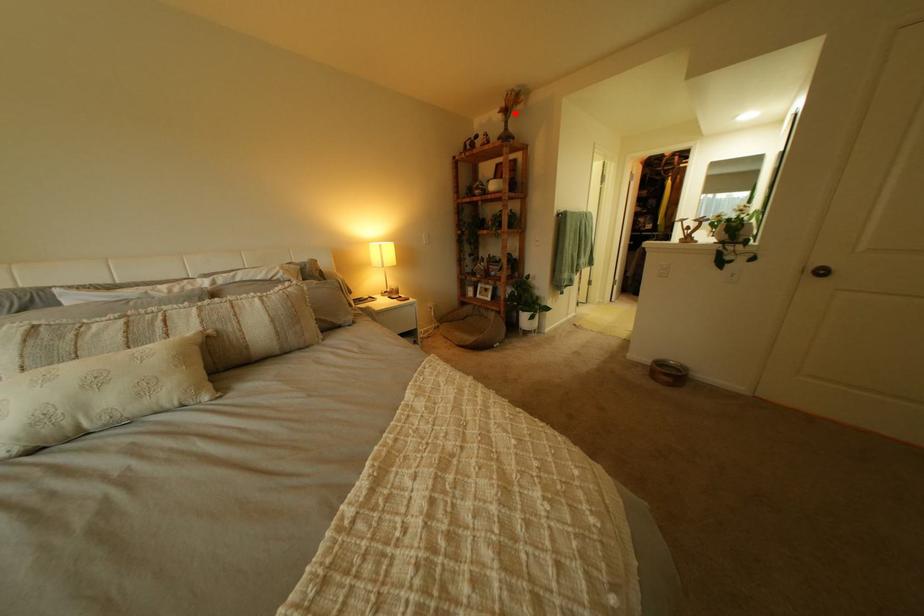
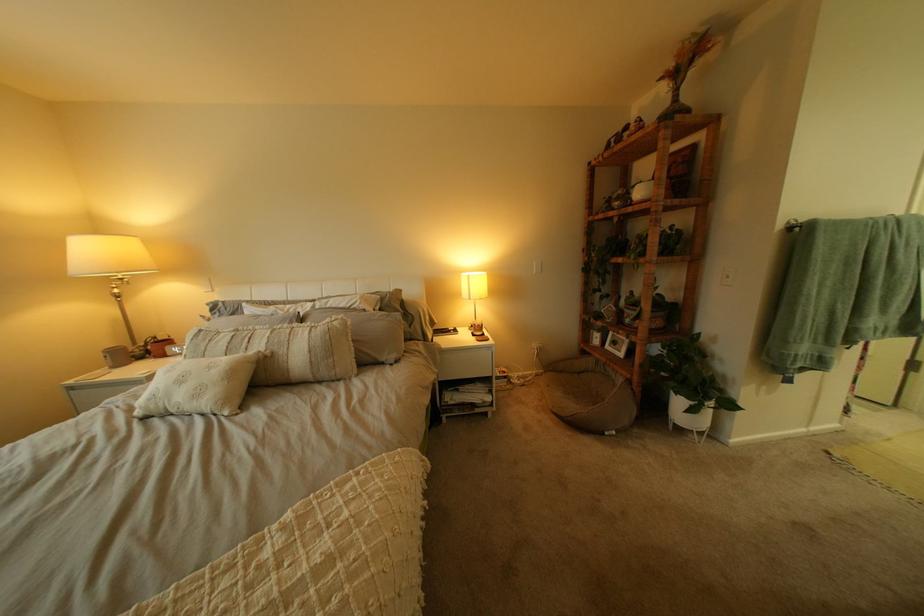
Question: I am providing you with two images of the same scene from different viewpoints. A red point is marked on the first image. Is the red point's position out of view in image 2?

Choices:
 (A) Yes
 (B) No

Answer: (B)